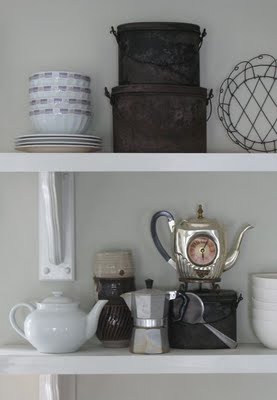
At what (x,y) coordinates should I click in order to perform the action: click on teapot spout. Please return your answer as a coordinate pair (x, y). This screenshot has width=277, height=400. Looking at the image, I should click on (92, 311), (126, 297), (241, 237).